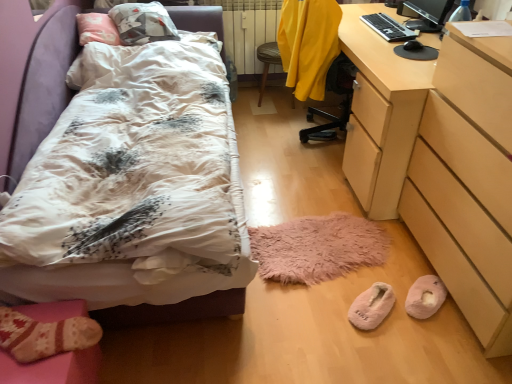
Question: Considering the relative positions of white floral duvet at left and pink fuzzy slippers at lower center, which is counted as the first footwear, starting from the left, in the image provided, is white floral duvet at left to the right of pink fuzzy slippers at lower center, which is counted as the first footwear, starting from the left, from the viewer's perspective?

Choices:
 (A) yes
 (B) no

Answer: (B)

Question: Is white floral duvet at left touching pink fuzzy slippers at lower center, which is counted as the first footwear, starting from the left?

Choices:
 (A) yes
 (B) no

Answer: (B)

Question: Is white floral duvet at left turned away from pink fuzzy slippers at lower center, which ranks as the 2th footwear in right-to-left order?

Choices:
 (A) yes
 (B) no

Answer: (B)

Question: From a real-world perspective, does white floral duvet at left stand above pink fuzzy slippers at lower center, which ranks as the 2th footwear in right-to-left order?

Choices:
 (A) yes
 (B) no

Answer: (A)

Question: Is pink fuzzy slippers at lower center, which is counted as the first footwear, starting from the left, completely or partially inside white floral duvet at left?

Choices:
 (A) yes
 (B) no

Answer: (B)

Question: Is white floral duvet at left at the left side of pink fuzzy slippers at lower center, which is counted as the first footwear, starting from the left?

Choices:
 (A) no
 (B) yes

Answer: (B)

Question: Considering the relative positions of yellow fabric swivel chair at center, which is the first swivel chair in front-to-back order, and knitted wool socks at lower left in the image provided, is yellow fabric swivel chair at center, which is the first swivel chair in front-to-back order, to the left of knitted wool socks at lower left from the viewer's perspective?

Choices:
 (A) yes
 (B) no

Answer: (B)

Question: Considering the relative sizes of yellow fabric swivel chair at center, which is the first swivel chair in front-to-back order, and knitted wool socks at lower left in the image provided, is yellow fabric swivel chair at center, which is the first swivel chair in front-to-back order, bigger than knitted wool socks at lower left?

Choices:
 (A) no
 (B) yes

Answer: (B)

Question: Is yellow fabric swivel chair at center, which is the first swivel chair in front-to-back order, beside knitted wool socks at lower left?

Choices:
 (A) no
 (B) yes

Answer: (A)

Question: Is yellow fabric swivel chair at center, the 2th swivel chair viewed from the back, located outside knitted wool socks at lower left?

Choices:
 (A) yes
 (B) no

Answer: (A)

Question: Is yellow fabric swivel chair at center, which is the first swivel chair in front-to-back order, positioned with its back to knitted wool socks at lower left?

Choices:
 (A) yes
 (B) no

Answer: (B)

Question: Considering the relative sizes of yellow fabric swivel chair at center, which is the first swivel chair in front-to-back order, and knitted wool socks at lower left in the image provided, is yellow fabric swivel chair at center, which is the first swivel chair in front-to-back order, wider than knitted wool socks at lower left?

Choices:
 (A) no
 (B) yes

Answer: (B)

Question: From a real-world perspective, is yellow fabric swivel chair at center, arranged as the first swivel chair when viewed from the back, located beneath pink fuzzy slippers at lower center, which ranks as the 2th footwear in right-to-left order?

Choices:
 (A) no
 (B) yes

Answer: (A)